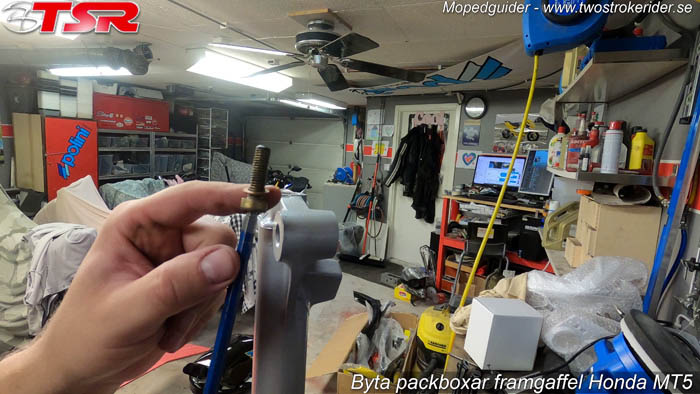
Where is `clock`? clock is located at coordinates pyautogui.click(x=472, y=102).